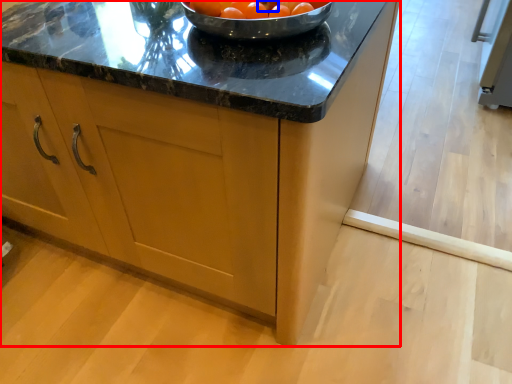
Question: Which of the following is the closest to the observer, cabinetry (highlighted by a red box) or tomato (highlighted by a blue box)?

Choices:
 (A) cabinetry
 (B) tomato

Answer: (A)